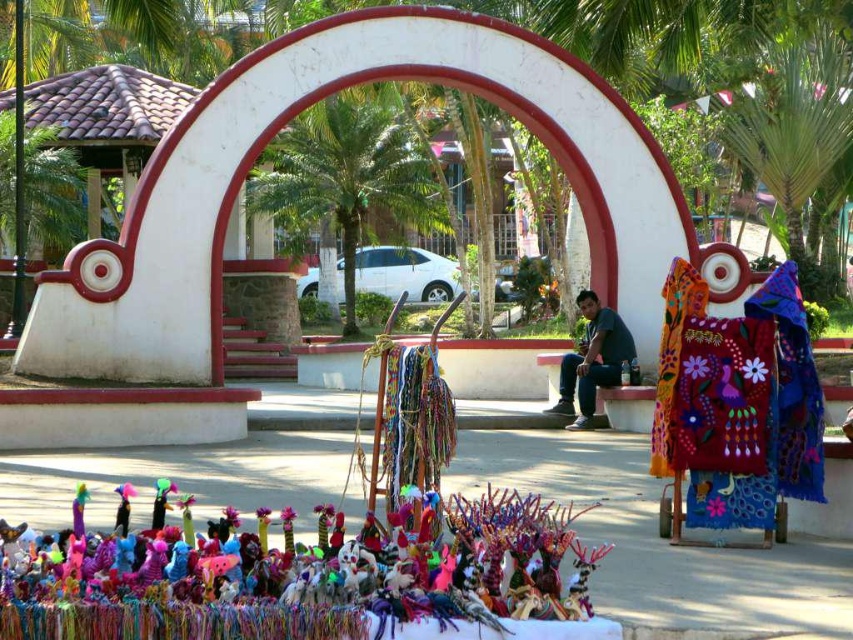
From the picture: You are a visitor standing in front of the white marble archway at center and the brightly colored yarn at lower center. Which object is taller?

The white marble archway at center is much taller than the brightly colored yarn at lower center.

You are standing in the public square and want to take a photo of the matte black shirt at center without including the white marble archway at center in the frame. Which direction should you move relative to the current position?

Move to the right side of the matte black shirt at center so that the white marble archway at center is out of the frame since the white marble archway at center is to the left of the matte black shirt at center.